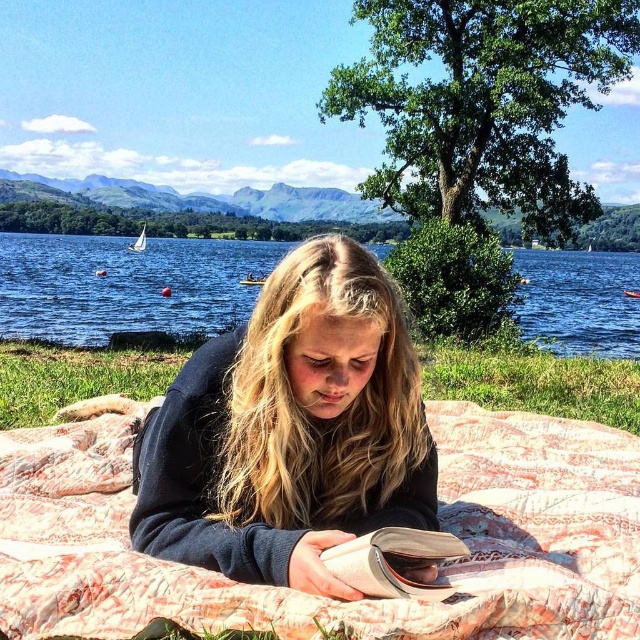
Question: Which point appears closest to the camera in this image?

Choices:
 (A) (564, 257)
 (B) (346, 500)
 (C) (616, 506)

Answer: (B)

Question: Is blue water at center in front of beige textured book at lower center?

Choices:
 (A) yes
 (B) no

Answer: (B)

Question: Which point is farther to the camera?

Choices:
 (A) (570, 291)
 (B) (365, 276)
 (C) (24, 340)

Answer: (A)

Question: Which point is farther to the camera?

Choices:
 (A) (364, 570)
 (B) (170, 531)

Answer: (B)

Question: Is blue water at center to the left of beige textured book at lower center from the viewer's perspective?

Choices:
 (A) yes
 (B) no

Answer: (A)

Question: Is pink quilted blanket at center behind dark blue sweater at center?

Choices:
 (A) yes
 (B) no

Answer: (B)